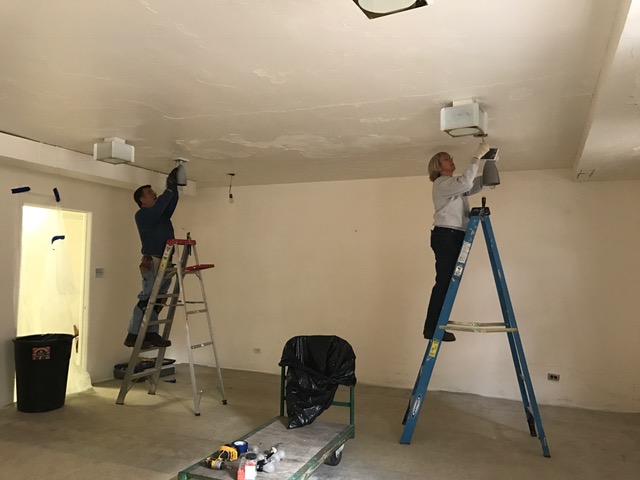
Locate an element on the screen. ladder is located at coordinates (450, 298), (148, 316).